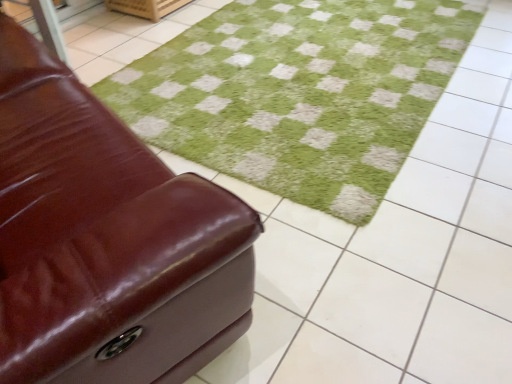
Where is `green soft rug at center`? green soft rug at center is located at coordinates (298, 93).

Image resolution: width=512 pixels, height=384 pixels. What do you see at coordinates (298, 93) in the screenshot?
I see `green soft rug at center` at bounding box center [298, 93].

This screenshot has height=384, width=512. What do you see at coordinates (106, 240) in the screenshot?
I see `shiny brown leather ottoman at left` at bounding box center [106, 240].

In order to face shiny brown leather ottoman at left, should I rotate leftwards or rightwards?

You should rotate left by 32.996 degrees.

You are a GUI agent. You are given a task and a screenshot of the screen. Output one action in this format:
    pyautogui.click(x=<x>, y=<y>)
    Task: Click on the shiny brown leather ottoman at left
    This screenshot has width=512, height=384.
    Given the screenshot: What is the action you would take?
    pyautogui.click(x=106, y=240)

This screenshot has height=384, width=512. In order to click on green soft rug at center in this screenshot , I will do `click(298, 93)`.

Consider the image. Can you confirm if shiny brown leather ottoman at left is positioned to the right of green soft rug at center?

No.

Is the depth of shiny brown leather ottoman at left less than that of green soft rug at center?

Yes, shiny brown leather ottoman at left is closer to the viewer.

Which is closer, (14,331) or (372,101)?

Point (14,331) is positioned closer to the camera compared to point (372,101).

From the image's perspective, is shiny brown leather ottoman at left positioned above or below green soft rug at center?

Based on their image positions, shiny brown leather ottoman at left is located beneath green soft rug at center.

From a real-world perspective, is shiny brown leather ottoman at left located beneath green soft rug at center?

No, from a real-world perspective, shiny brown leather ottoman at left is not below green soft rug at center.

Does shiny brown leather ottoman at left have a greater width compared to green soft rug at center?

No.

Who is taller, shiny brown leather ottoman at left or green soft rug at center?

With more height is shiny brown leather ottoman at left.

Is shiny brown leather ottoman at left bigger or smaller than green soft rug at center?

Clearly, shiny brown leather ottoman at left is larger in size than green soft rug at center.

Is green soft rug at center completely or partially inside shiny brown leather ottoman at left?

No.

Is shiny brown leather ottoman at left not near green soft rug at center?

No, shiny brown leather ottoman at left is not far from green soft rug at center.

Is shiny brown leather ottoman at left turned away from green soft rug at center?

No.

How different are the orientations of shiny brown leather ottoman at left and green soft rug at center in degrees?

The angular difference between shiny brown leather ottoman at left and green soft rug at center is 108 degrees.

Identify the location of furniture that is below the green soft rug at center (from the image's perspective). (106, 240).

Consider the image. Considering the relative positions of green soft rug at center and shiny brown leather ottoman at left in the image provided, is green soft rug at center to the left of shiny brown leather ottoman at left from the viewer's perspective?

No, green soft rug at center is not to the left of shiny brown leather ottoman at left.

Looking at this image, which is in front, green soft rug at center or shiny brown leather ottoman at left?

shiny brown leather ottoman at left is in front.

Considering the positions of point (415, 102) and point (201, 323), is point (415, 102) closer or farther from the camera than point (201, 323)?

Clearly, point (415, 102) is more distant from the camera than point (201, 323).

From the image's perspective, does green soft rug at center appear lower than shiny brown leather ottoman at left?

No.

From a real-world perspective, which object rests below the other?

From a 3D spatial view, green soft rug at center is below.

Considering the sizes of green soft rug at center and shiny brown leather ottoman at left in the image, is green soft rug at center wider or thinner than shiny brown leather ottoman at left?

In the image, green soft rug at center appears to be wider than shiny brown leather ottoman at left.

In terms of height, does green soft rug at center look taller or shorter compared to shiny brown leather ottoman at left?

Considering their sizes, green soft rug at center has less height than shiny brown leather ottoman at left.

Consider the image. Is green soft rug at center bigger than shiny brown leather ottoman at left?

No.

Is green soft rug at center inside or outside of shiny brown leather ottoman at left?

The correct answer is: outside.

Consider the image. Does green soft rug at center touch shiny brown leather ottoman at left?

No.

Is green soft rug at center oriented away from shiny brown leather ottoman at left?

No, green soft rug at center is not facing away from shiny brown leather ottoman at left.

Can you tell me how much green soft rug at center and shiny brown leather ottoman at left differ in facing direction?

The angle between the facing direction of green soft rug at center and the facing direction of shiny brown leather ottoman at left is 108 degrees.

Locate an element on the screen. furniture above the green soft rug at center (from a real-world perspective) is located at coordinates (106, 240).

Locate an element on the screen. furniture above the green soft rug at center (from a real-world perspective) is located at coordinates (106, 240).

You are a GUI agent. You are given a task and a screenshot of the screen. Output one action in this format:
    pyautogui.click(x=<x>, y=<y>)
    Task: Click on the grass located on the right of shiny brown leather ottoman at left
    This screenshot has width=512, height=384.
    Given the screenshot: What is the action you would take?
    pyautogui.click(x=298, y=93)